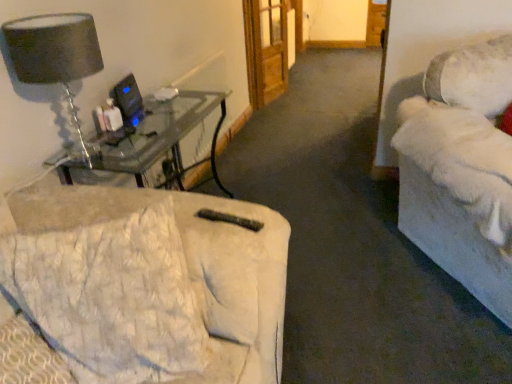
Question: In the image, is white plush couch at right, the second studio couch from the left, positioned in front of or behind white quilted fabric at lower left, placed as the 2th studio couch when sorted from right to left?

Choices:
 (A) front
 (B) behind

Answer: (B)

Question: Considering the positions of point coord(505,299) and point coord(138,271), is point coord(505,299) closer or farther from the camera than point coord(138,271)?

Choices:
 (A) farther
 (B) closer

Answer: (A)

Question: Which is farther from the white quilted fabric at lower left, the first studio couch positioned from the left?

Choices:
 (A) matte glass table lamp at upper left
 (B) white plush couch at right, the second studio couch from the left
 (C) black plastic computer monitor at upper left
 (D) wooden door at center

Answer: (D)

Question: Which object is the closest to the black plastic computer monitor at upper left?

Choices:
 (A) white quilted fabric at lower left, placed as the 2th studio couch when sorted from right to left
 (B) wooden door at center
 (C) white plush couch at right, the second studio couch from the left
 (D) matte glass table lamp at upper left

Answer: (D)